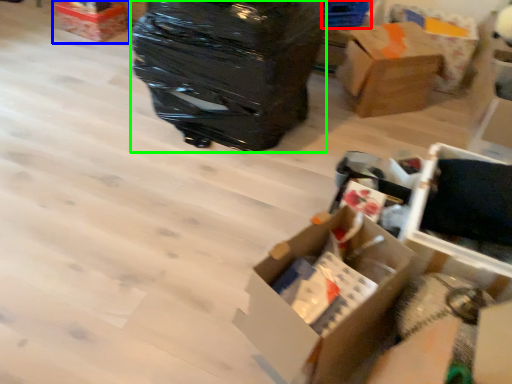
Question: Which object is the farthest from storage box (highlighted by a red box)? Choose among these: box (highlighted by a blue box) or garbage (highlighted by a green box).

Choices:
 (A) box
 (B) garbage

Answer: (A)